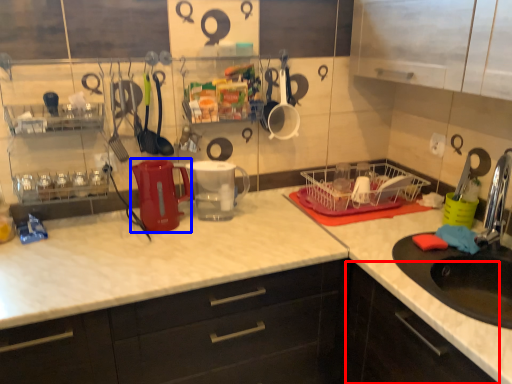
Question: Which of the following is the closest to the observer, cabinetry (highlighted by a red box) or appliance (highlighted by a blue box)?

Choices:
 (A) cabinetry
 (B) appliance

Answer: (A)